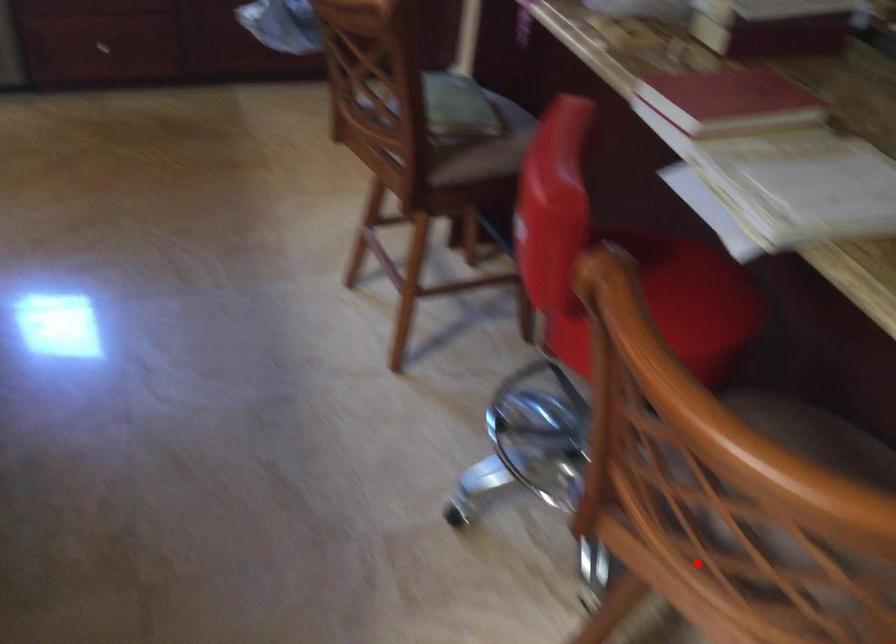
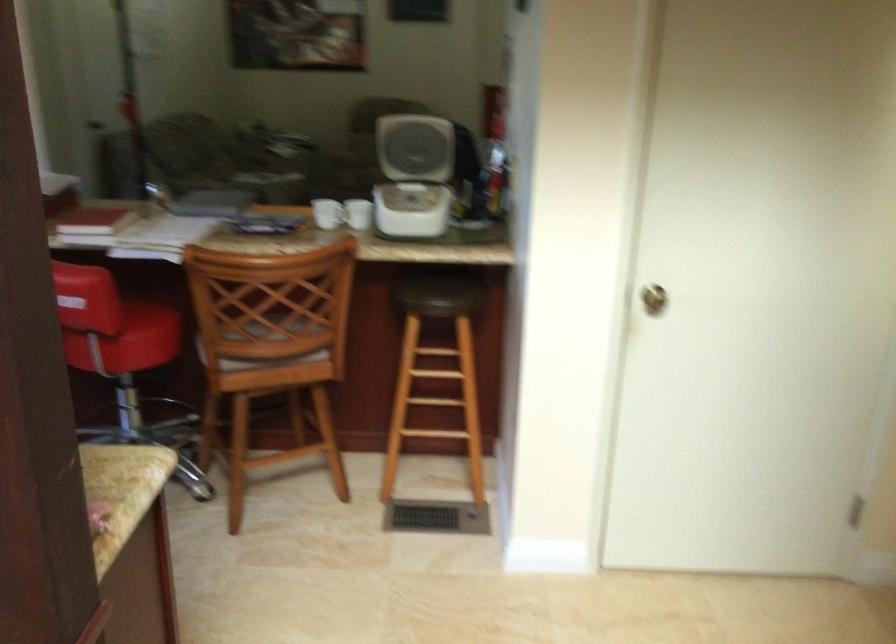
Question: I am providing you with two images of the same scene from different viewpoints. Given a red point in image1, look at the same physical point in image2. Is it:

Choices:
 (A) Closer to the viewpoint
 (B) Farther from the viewpoint

Answer: (B)